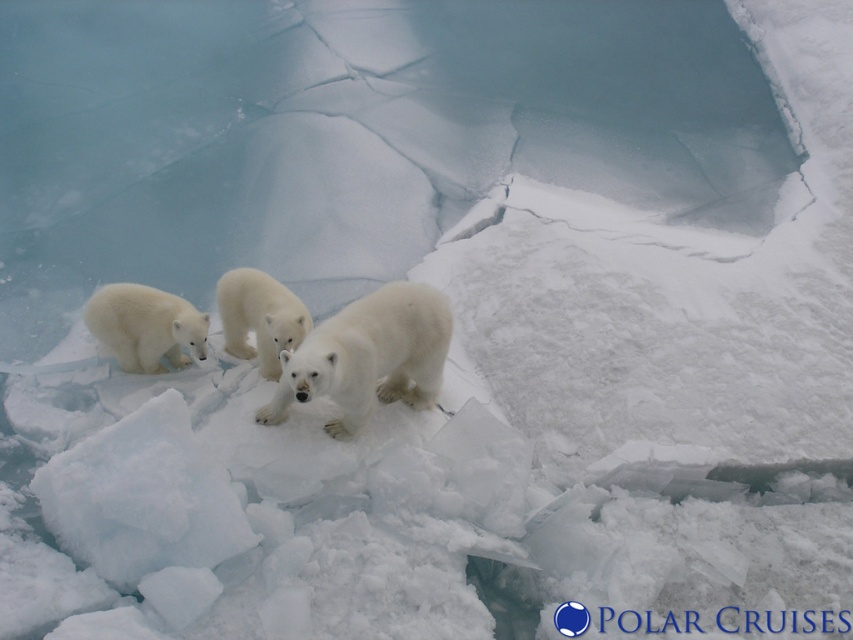
You observe two polar bears in the icy landscape. Which one is positioned to the right side between the white fluffy bear at center and the white fur bear at center?

The white fluffy bear at center is positioned to the right of the white fur bear at center.

You are a wildlife photographer observing the polar bears. You want to capture a photo that includes both the white fluffy bear at center and the white fluffy bear cub at lower left. Based on their positions, which bear should you focus on first to ensure both are in the frame?

The white fluffy bear cub at lower left should be focused on first since the white fluffy bear at center is to the right of it, allowing the photographer to frame both by starting with the cub on the left.

You are a wildlife photographer aiming to capture a photo of the white fluffy bear cub at lower left and the white fur bear at center. You need to ensure both are fully visible in the frame. Based on their sizes, which bear should you focus on to ensure the cub is entirely in the shot?

The white fluffy bear cub at lower left might be wider than the white fur bear at center, so focusing on the cub ensures it fits entirely within the frame.